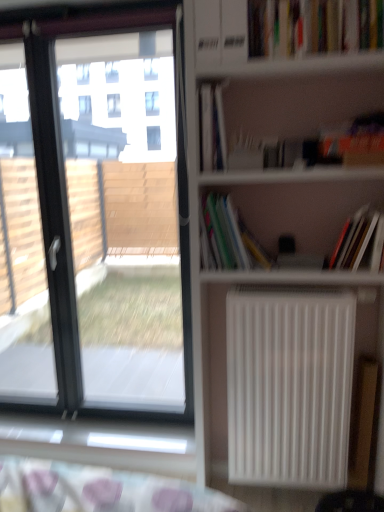
Question: Could you tell me if hardcover book at upper center, which ranks as the second book in top-to-bottom order, is facing transparent glass window at left?

Choices:
 (A) yes
 (B) no

Answer: (B)

Question: Does hardcover book at upper center, marked as the 3th book in a bottom-to-top arrangement, have a smaller size compared to transparent glass window at left?

Choices:
 (A) yes
 (B) no

Answer: (A)

Question: Is hardcover book at upper center, which ranks as the second book in top-to-bottom order, bigger than transparent glass window at left?

Choices:
 (A) no
 (B) yes

Answer: (A)

Question: From a real-world perspective, is hardcover book at upper center, which ranks as the second book in top-to-bottom order, beneath transparent glass window at left?

Choices:
 (A) no
 (B) yes

Answer: (A)

Question: Considering the relative sizes of hardcover book at upper center, which ranks as the second book in top-to-bottom order, and transparent glass window at left in the image provided, is hardcover book at upper center, which ranks as the second book in top-to-bottom order, thinner than transparent glass window at left?

Choices:
 (A) yes
 (B) no

Answer: (B)

Question: Does hardcover book at upper center, which ranks as the second book in top-to-bottom order, lie in front of transparent glass window at left?

Choices:
 (A) yes
 (B) no

Answer: (A)

Question: Considering the relative sizes of white matte radiator at center right and transparent glass window at left in the image provided, is white matte radiator at center right bigger than transparent glass window at left?

Choices:
 (A) no
 (B) yes

Answer: (A)

Question: Is the surface of white matte radiator at center right in direct contact with transparent glass window at left?

Choices:
 (A) yes
 (B) no

Answer: (B)

Question: Is white matte radiator at center right in front of transparent glass window at left?

Choices:
 (A) no
 (B) yes

Answer: (B)

Question: From the image's perspective, is white matte radiator at center right under transparent glass window at left?

Choices:
 (A) no
 (B) yes

Answer: (B)

Question: Considering the relative sizes of white matte radiator at center right and transparent glass window at left in the image provided, is white matte radiator at center right taller than transparent glass window at left?

Choices:
 (A) yes
 (B) no

Answer: (B)

Question: From a real-world perspective, is white matte radiator at center right beneath transparent glass window at left?

Choices:
 (A) no
 (B) yes

Answer: (B)

Question: Is the depth of hardcover book at right, which appears as the fourth book when viewed from the top, less than that of white matte radiator at center right?

Choices:
 (A) yes
 (B) no

Answer: (A)